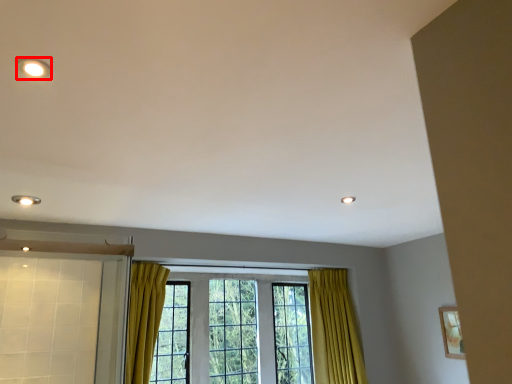
Question: From the image's perspective, what is the correct spatial relationship of lighting (annotated by the red box) in relation to window?

Choices:
 (A) above
 (B) below

Answer: (A)